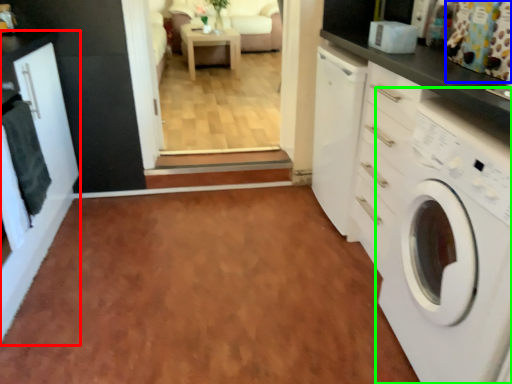
Question: Based on their relative distances, which object is farther from cabinetry (highlighted by a red box)? Choose from curtain (highlighted by a blue box) and washing machine (highlighted by a green box).

Choices:
 (A) curtain
 (B) washing machine

Answer: (A)